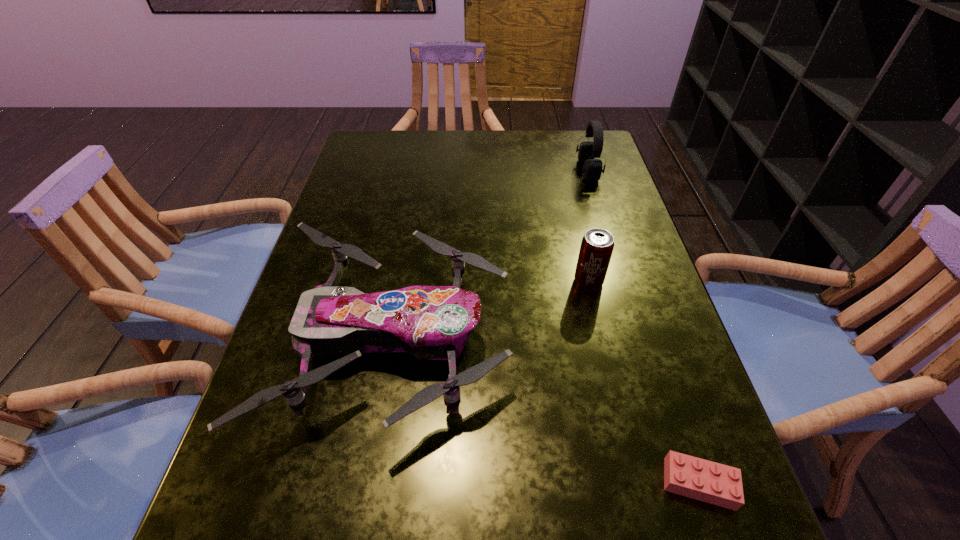
Image resolution: width=960 pixels, height=540 pixels. Identify the location of headset. (592, 168).

The image size is (960, 540). In order to click on the third object from right to left in this screenshot , I will do `click(597, 245)`.

This screenshot has height=540, width=960. What are the coordinates of `the leftmost object` in the screenshot? It's located at (429, 322).

Where is `drone`? The image size is (960, 540). drone is located at coordinates (429, 322).

Where is `Lego`? This screenshot has width=960, height=540. Lego is located at coordinates (696, 478).

What are the coordinates of `vacant area situated 0.390m on the headband of the farthest object` in the screenshot? It's located at click(x=443, y=170).

Find the location of a particular element. Image resolution: width=960 pixels, height=540 pixels. vacant space located 0.220m on the headband of the farthest object is located at coordinates (502, 170).

Where is `vacant space located 0.080m on the headband of the farthest object`? The width and height of the screenshot is (960, 540). vacant space located 0.080m on the headband of the farthest object is located at coordinates (550, 170).

Where is `free space located on the front of the beer can`? free space located on the front of the beer can is located at coordinates (624, 431).

Where is `free region located on the front-facing side of the drone`? free region located on the front-facing side of the drone is located at coordinates (585, 340).